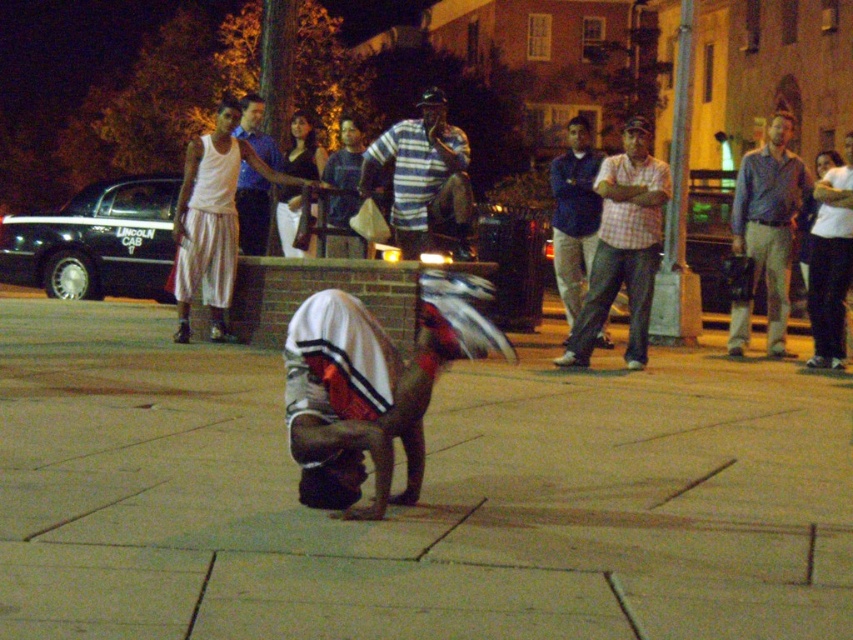
Question: Which point is farther from the camera taking this photo?

Choices:
 (A) (814, 285)
 (B) (216, 176)

Answer: (A)

Question: Is blue striped shirt at center wider than white cotton shirt at upper right?

Choices:
 (A) yes
 (B) no

Answer: (B)

Question: Which object is positioned closest to the brown concrete pavement at center?

Choices:
 (A) blue striped shirt at center
 (B) white cotton tank top at upper center
 (C) striped cotton shirt at center
 (D) white cotton tank top at upper left

Answer: (B)

Question: Estimate the real-world distances between objects in this image. Which object is farther from the blue striped shirt at center?

Choices:
 (A) striped cotton shirt at center
 (B) blue denim jeans at center
 (C) white cotton shirt at upper right
 (D) white cotton tank top at upper left

Answer: (D)

Question: From the image, what is the correct spatial relationship of striped cotton shirt at center in relation to white cotton tank top at upper left?

Choices:
 (A) above
 (B) below

Answer: (B)

Question: Does white fabric head at center appear on the right side of white cotton tank top at upper center?

Choices:
 (A) yes
 (B) no

Answer: (A)